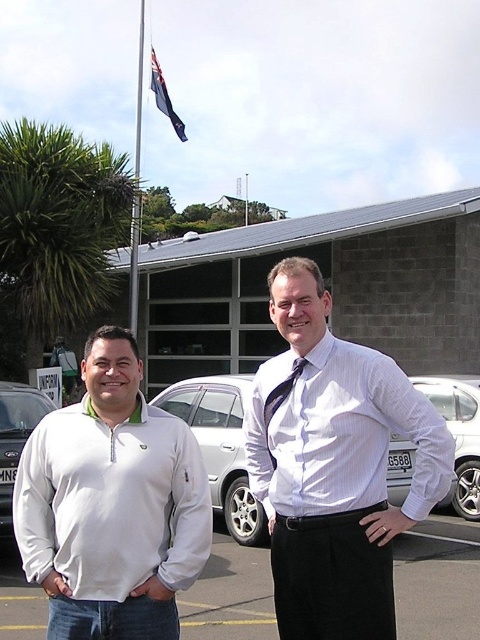
Question: Does white striped shirt at center appear on the left side of silver metallic sedan at center?

Choices:
 (A) yes
 (B) no

Answer: (B)

Question: Which object is farther from the camera taking this photo?

Choices:
 (A) white striped shirt at center
 (B) black satin tie at center
 (C) silver metallic sedan at center
 (D) blue fabric flag at upper center

Answer: (D)

Question: Can you confirm if white striped shirt at center is positioned to the left of black asphalt at lower center?

Choices:
 (A) yes
 (B) no

Answer: (B)

Question: Can you confirm if white striped shirt at center is positioned above white fleece at center?

Choices:
 (A) no
 (B) yes

Answer: (B)

Question: Which of the following is the farthest from the observer?

Choices:
 (A) (241, 392)
 (B) (0, 428)
 (C) (137, 237)
 (D) (180, 461)

Answer: (C)

Question: Estimate the real-world distances between objects in this image. Which object is farther from the silver metallic car at center?

Choices:
 (A) white striped shirt at center
 (B) silver metallic sedan at center
 (C) blue fabric flag at upper center
 (D) white fleece at center

Answer: (C)